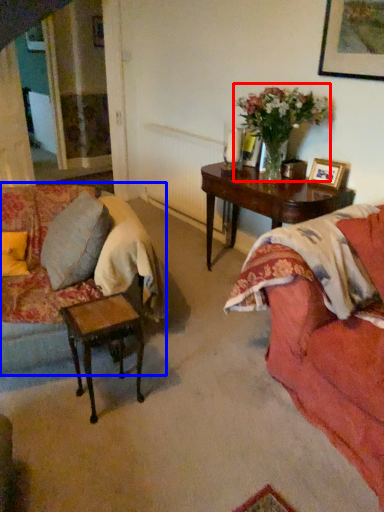
Question: Which of the following is the closest to the observer, floral arrangement (highlighted by a red box) or studio couch (highlighted by a blue box)?

Choices:
 (A) floral arrangement
 (B) studio couch

Answer: (B)